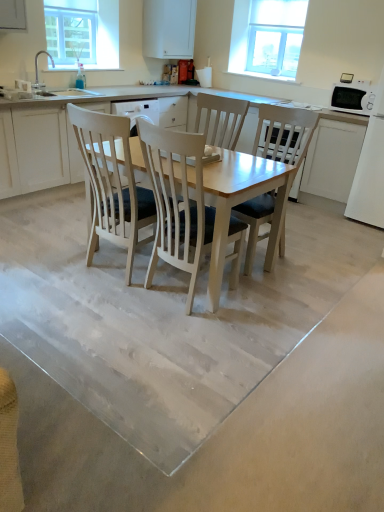
Where is `vacant area that lies to the right of light wood chair at center, the 2th chair from the left`? The width and height of the screenshot is (384, 512). vacant area that lies to the right of light wood chair at center, the 2th chair from the left is located at coordinates tap(315, 266).